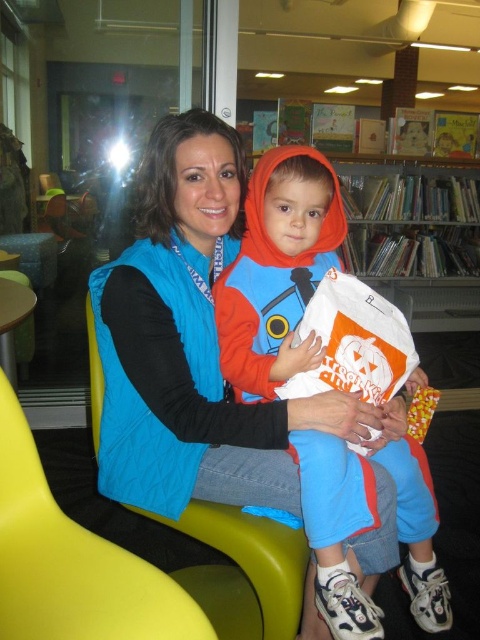
Can you confirm if matte orange hoodie at center is bigger than matte plastic chair at center?

Yes, matte orange hoodie at center is bigger than matte plastic chair at center.

Which is behind, point (300, 284) or point (205, 540)?

The point (300, 284) is behind.

Is point (367, 484) in front of point (99, 371)?

Yes, point (367, 484) is closer to viewer.

What are the coordinates of `matte orange hoodie at center` in the screenshot? It's located at (277, 269).

Does wooden bookshelf at upper center have a lesser width compared to matte plastic chair at center?

Incorrect, wooden bookshelf at upper center's width is not less than matte plastic chair at center's.

Can you confirm if wooden bookshelf at upper center is smaller than matte plastic chair at center?

Actually, wooden bookshelf at upper center might be larger than matte plastic chair at center.

Between point (406, 256) and point (219, 512), which one is positioned behind?

Positioned behind is point (406, 256).

Identify the location of wooden bookshelf at upper center. (418, 252).

Between matte orange hoodie at center and wooden bookshelf at upper center, which one appears on the left side from the viewer's perspective?

Positioned to the left is matte orange hoodie at center.

Locate an element on the screen. The image size is (480, 640). matte orange hoodie at center is located at coordinates (277, 269).